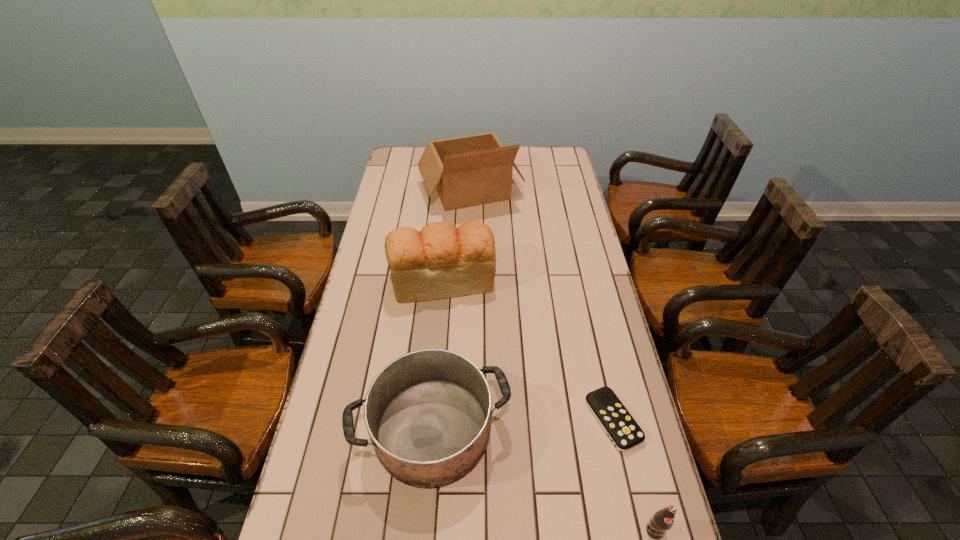
Identify the location of object situated at the far edge. The width and height of the screenshot is (960, 540). (467, 171).

Find the location of `box that is at the left edge`. box that is at the left edge is located at coordinates (467, 171).

Find the location of a particular element. The width and height of the screenshot is (960, 540). bread at the left edge is located at coordinates (441, 261).

Where is `saucepan positioned at the left edge`? Image resolution: width=960 pixels, height=540 pixels. saucepan positioned at the left edge is located at coordinates (428, 413).

Where is `object located at the right edge`? The image size is (960, 540). object located at the right edge is located at coordinates (619, 425).

Find the location of `object situated at the far left corner`. object situated at the far left corner is located at coordinates (467, 171).

Find the location of a particular element. The height and width of the screenshot is (540, 960). vacant area at the far edge is located at coordinates (519, 165).

This screenshot has height=540, width=960. Identify the location of vacant space at the left edge. (402, 175).

Identify the location of vacant space at the right edge of the desktop. (586, 291).

Where is `vacant space at the far left corner`? The height and width of the screenshot is (540, 960). vacant space at the far left corner is located at coordinates (418, 158).